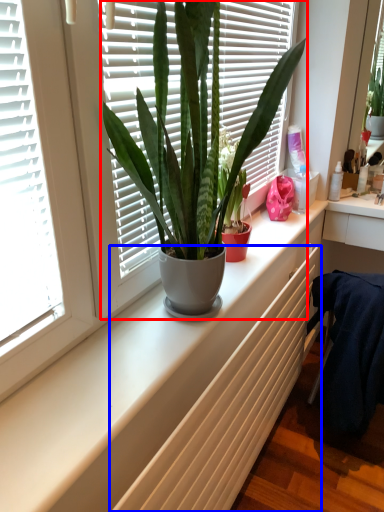
Question: Which of the following is the farthest to the observer, houseplant (highlighted by a red box) or radiator (highlighted by a blue box)?

Choices:
 (A) houseplant
 (B) radiator

Answer: (A)